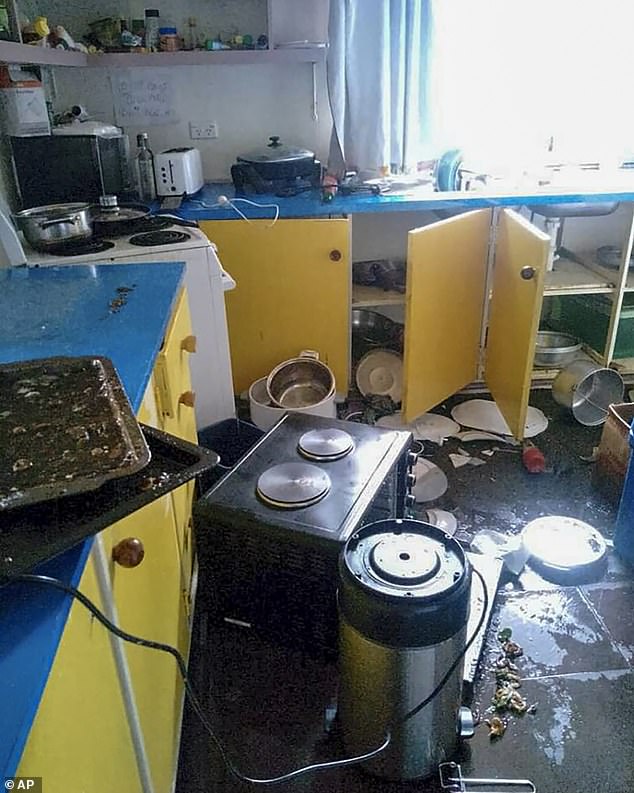
Where is `outlet`? The image size is (634, 793). outlet is located at coordinates (198, 129).